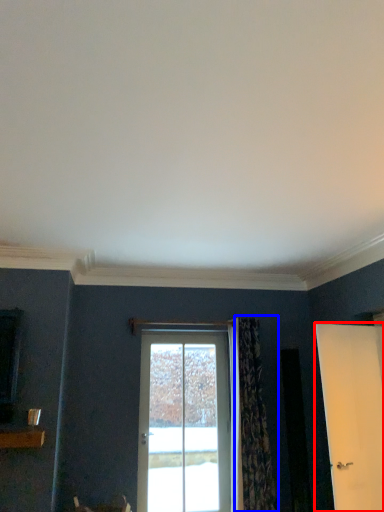
Question: Which object appears farthest to the camera in this image, door (highlighted by a red box) or curtain (highlighted by a blue box)?

Choices:
 (A) door
 (B) curtain

Answer: (B)